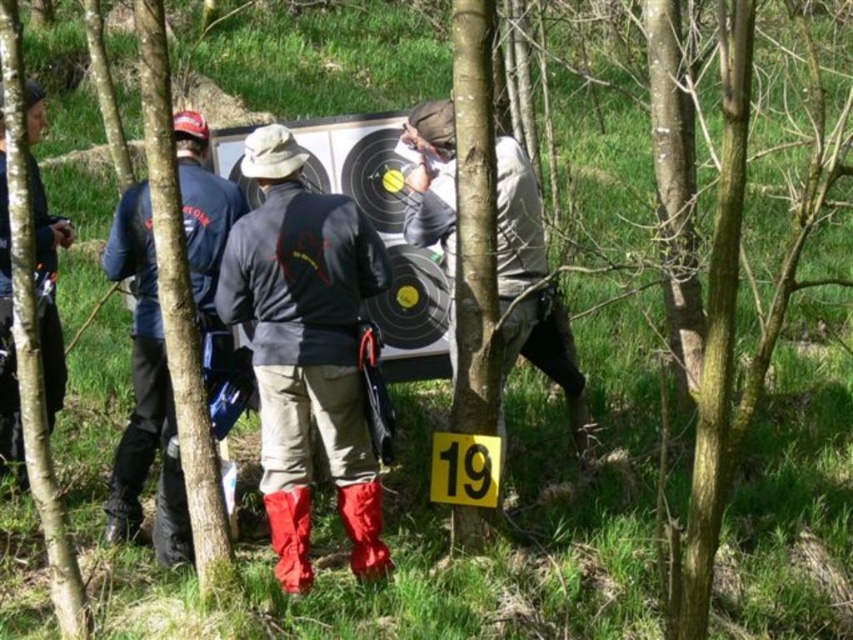
Question: Is khaki fabric jacket at center closer to the viewer compared to dark blue jacket at left?

Choices:
 (A) yes
 (B) no

Answer: (A)

Question: Is yellow paper sign at center smaller than rubber/mesh boot at lower left?

Choices:
 (A) yes
 (B) no

Answer: (A)

Question: Which object is positioned farthest from the brushed metal jacket at left?

Choices:
 (A) red rubber boot at lower center
 (B) rubber matte boot at lower center

Answer: (A)

Question: Based on their relative distances, which object is nearer to the dark gray leather jacket at center?

Choices:
 (A) dark blue jacket at left
 (B) yellow paper sign at center

Answer: (B)

Question: Which point is closer to the camera?

Choices:
 (A) (433, 472)
 (B) (125, 458)
 (C) (375, 518)
 (D) (218, 177)

Answer: (C)

Question: Does brushed metal jacket at left come behind rubber matte boot at lower center?

Choices:
 (A) yes
 (B) no

Answer: (A)